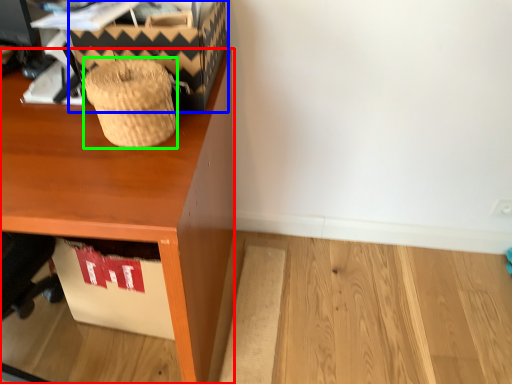
Question: Estimate the real-world distances between objects in this image. Which object is closer to desk (highlighted by a red box), shoe box (highlighted by a blue box) or basket (highlighted by a green box)?

Choices:
 (A) shoe box
 (B) basket

Answer: (B)